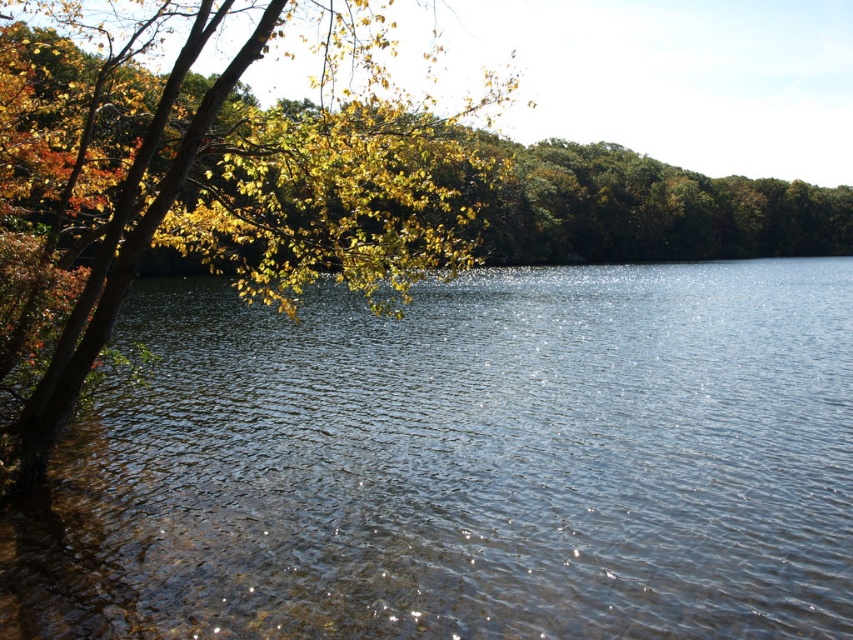
You are standing at the lakeside and see two points marked in the image. The first point is located at coordinates point (194, 380) and the second point is at point (343, 93). Which point is closer to you?

Point (194, 380) is in front of point (343, 93), so it is closer to you.